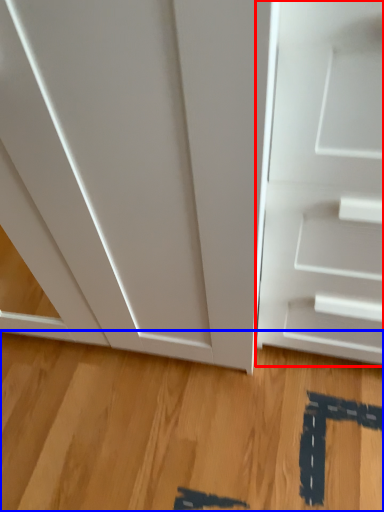
Question: Among these objects, which one is nearest to the camera, door (highlighted by a red box) or hardwood (highlighted by a blue box)?

Choices:
 (A) door
 (B) hardwood

Answer: (A)